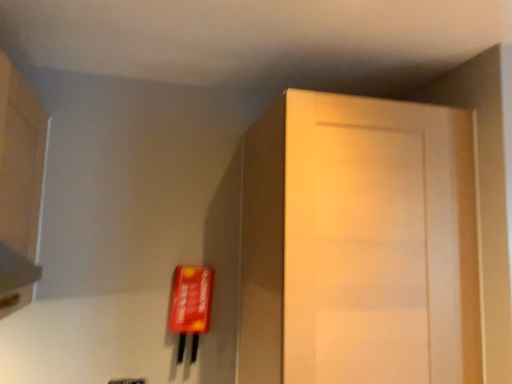
What do you see at coordinates (19, 187) in the screenshot? The height and width of the screenshot is (384, 512). I see `matte wood cabinet at upper left` at bounding box center [19, 187].

Identify the location of matte wood cabinet at upper left. (19, 187).

What do you see at coordinates (359, 244) in the screenshot?
I see `matte wood door at right` at bounding box center [359, 244].

At what (x,y) coordinates should I click in order to perform the action: click on matte wood door at right. Please return your answer as a coordinate pair (x, y). Looking at the image, I should click on (359, 244).

Locate an element on the screen. matte wood cabinet at upper left is located at coordinates (19, 187).

Does matte wood door at right appear on the right side of matte wood cabinet at upper left?

Yes, matte wood door at right is to the right of matte wood cabinet at upper left.

Considering their positions, is matte wood door at right located in front of or behind matte wood cabinet at upper left?

matte wood door at right is positioned farther from the viewer than matte wood cabinet at upper left.

Does point (442, 179) lie behind point (9, 209)?

Yes, point (442, 179) is farther from viewer.

From the image's perspective, between matte wood door at right and matte wood cabinet at upper left, who is located below?

From the image's view, matte wood door at right is below.

From a real-world perspective, which object stands above the other?

In real-world perspective, matte wood cabinet at upper left is above.

Considering the relative sizes of matte wood door at right and matte wood cabinet at upper left in the image provided, is matte wood door at right thinner than matte wood cabinet at upper left?

No, matte wood door at right is not thinner than matte wood cabinet at upper left.

Is matte wood door at right taller or shorter than matte wood cabinet at upper left?

Clearly, matte wood door at right is taller compared to matte wood cabinet at upper left.

Between matte wood door at right and matte wood cabinet at upper left, which one has smaller size?

matte wood cabinet at upper left.

Is matte wood door at right outside of matte wood cabinet at upper left?

Yes, matte wood door at right is not within matte wood cabinet at upper left.

Based on the photo, is matte wood door at right next to matte wood cabinet at upper left and touching it?

matte wood door at right and matte wood cabinet at upper left are clearly separated.

Is matte wood door at right looking in the opposite direction of matte wood cabinet at upper left?

No, matte wood door at right is not facing the opposite direction of matte wood cabinet at upper left.

How many degrees apart are the facing directions of matte wood door at right and matte wood cabinet at upper left?

90.2 degrees.

Where is `door behind the matte wood cabinet at upper left`? Image resolution: width=512 pixels, height=384 pixels. door behind the matte wood cabinet at upper left is located at coordinates (359, 244).

Does matte wood cabinet at upper left appear on the right side of matte wood door at right?

No, matte wood cabinet at upper left is not to the right of matte wood door at right.

In the image, is matte wood cabinet at upper left positioned in front of or behind matte wood door at right?

matte wood cabinet at upper left is in front of matte wood door at right.

Which is nearer, (33, 121) or (435, 176)?

Clearly, point (33, 121) is more distant from the camera than point (435, 176).

From the image's perspective, is matte wood cabinet at upper left positioned above or below matte wood door at right?

From the image's perspective, matte wood cabinet at upper left appears above matte wood door at right.

Looking at this image, from a real-world perspective, is matte wood cabinet at upper left beneath matte wood door at right?

No, from a real-world perspective, matte wood cabinet at upper left is not under matte wood door at right.

Is matte wood cabinet at upper left wider than matte wood door at right?

No.

In the scene shown: Between matte wood cabinet at upper left and matte wood door at right, which one has more height?

matte wood door at right.

Based on their sizes in the image, would you say matte wood cabinet at upper left is bigger or smaller than matte wood door at right?

Considering their sizes, matte wood cabinet at upper left takes up less space than matte wood door at right.

Consider the image. Is matte wood cabinet at upper left outside of matte wood door at right?

matte wood cabinet at upper left is positioned outside matte wood door at right.

Is matte wood cabinet at upper left far from matte wood door at right?

Yes, matte wood cabinet at upper left and matte wood door at right are located far from each other.

Is matte wood cabinet at upper left facing away from matte wood door at right?

matte wood cabinet at upper left does not have its back to matte wood door at right.

How different are the orientations of matte wood cabinet at upper left and matte wood door at right in degrees?

90.2 degrees.

Locate an element on the screen. cabinetry that appears above the matte wood door at right (from a real-world perspective) is located at coordinates (19, 187).

Image resolution: width=512 pixels, height=384 pixels. I want to click on door directly beneath the matte wood cabinet at upper left (from a real-world perspective), so click(x=359, y=244).

Locate an element on the screen. Image resolution: width=512 pixels, height=384 pixels. door lying behind the matte wood cabinet at upper left is located at coordinates (359, 244).